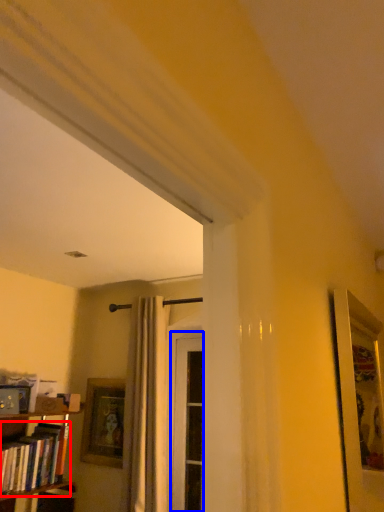
Question: Which point is closer to the camera, book (highlighted by a red box) or screen door (highlighted by a blue box)?

Choices:
 (A) book
 (B) screen door

Answer: (A)